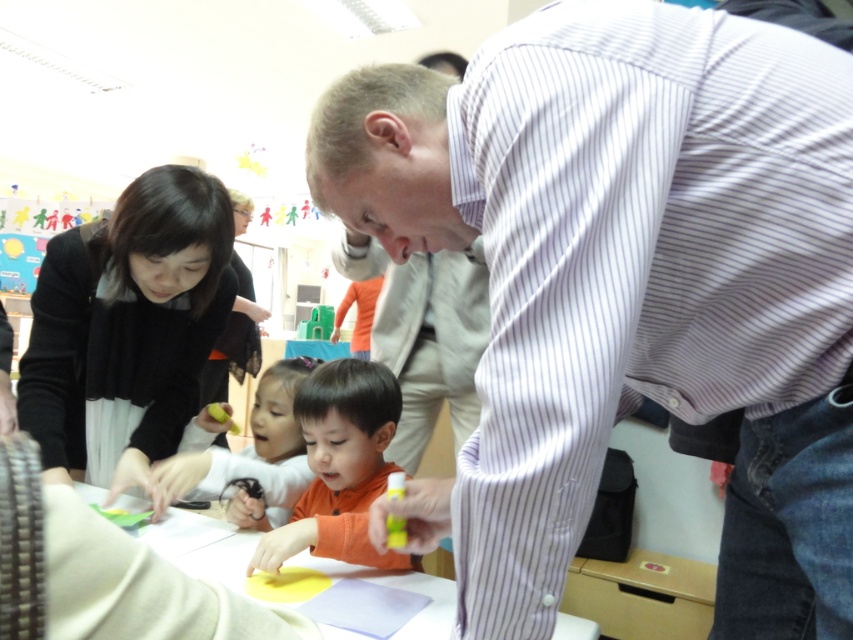
Between smooth yellow paper at center and smooth orange shirt at center, which one is positioned higher?

Positioned higher is smooth orange shirt at center.

Between smooth yellow paper at center and smooth orange shirt at center, which one has less height?

smooth yellow paper at center

Who is more distant from viewer, (190, 541) or (190, 452)?

The point (190, 452) is more distant.

This screenshot has height=640, width=853. Find the location of `smooth yellow paper at center`. smooth yellow paper at center is located at coordinates (202, 547).

Is white striped shirt at upper right to the right of smooth yellow paper at center from the viewer's perspective?

Correct, you'll find white striped shirt at upper right to the right of smooth yellow paper at center.

Is white striped shirt at upper right to the left of smooth yellow paper at center from the viewer's perspective?

Incorrect, white striped shirt at upper right is not on the left side of smooth yellow paper at center.

Locate an element on the screen. This screenshot has width=853, height=640. white striped shirt at upper right is located at coordinates (630, 284).

Find the location of a particular element. This screenshot has width=853, height=640. white striped shirt at upper right is located at coordinates (630, 284).

Does point (822, 109) come behind point (341, 518)?

No, it is not.

What are the coordinates of `white striped shirt at upper right` in the screenshot? It's located at click(630, 284).